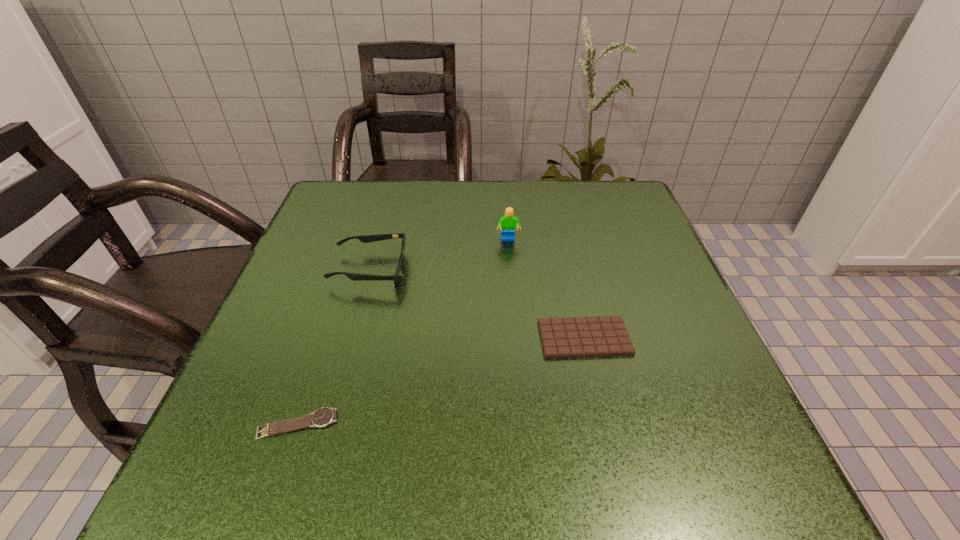
The image size is (960, 540). In order to click on free spot that satisfies the following two spatial constraints: 1. on the front-facing side of the third nearest object; 2. on the left side of the second shortest object in this screenshot , I will do coord(350,338).

What are the coordinates of `vacant space that satisfies the following two spatial constraints: 1. on the front-facing side of the chocolate bar; 2. on the right side of the second farthest object` in the screenshot? It's located at (350, 338).